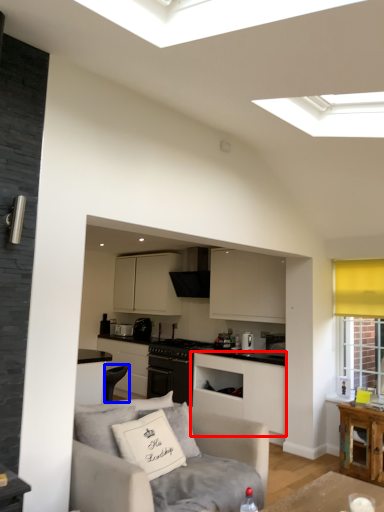
Question: Among these objects, which one is farthest to the camera, cabinetry (highlighted by a red box) or armchair (highlighted by a blue box)?

Choices:
 (A) cabinetry
 (B) armchair

Answer: (B)